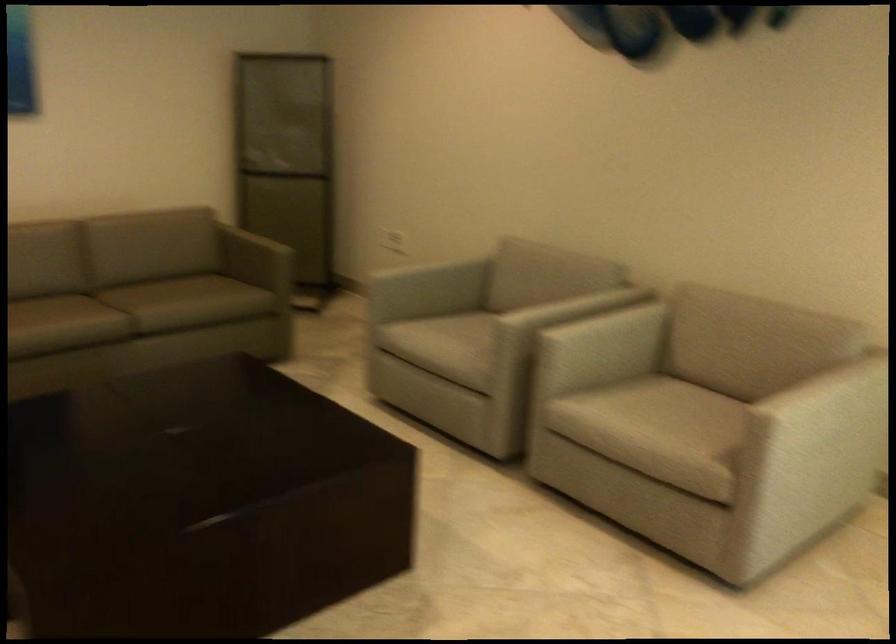
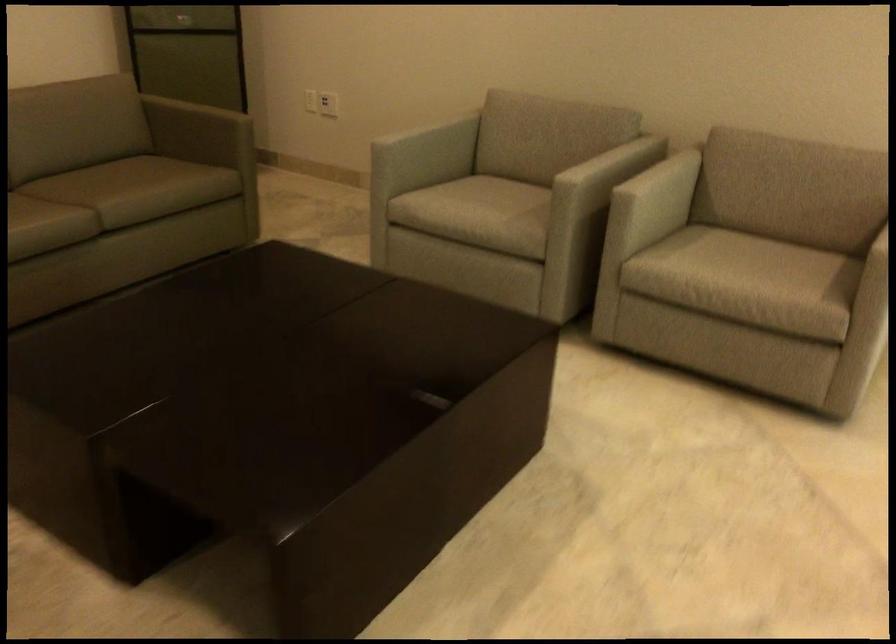
Question: Which direction would the cameraman need to move to produce the second image? Reply with the corresponding letter.

Choices:
 (A) Left
 (B) Right
 (C) Forward
 (D) Backward

Answer: (A)